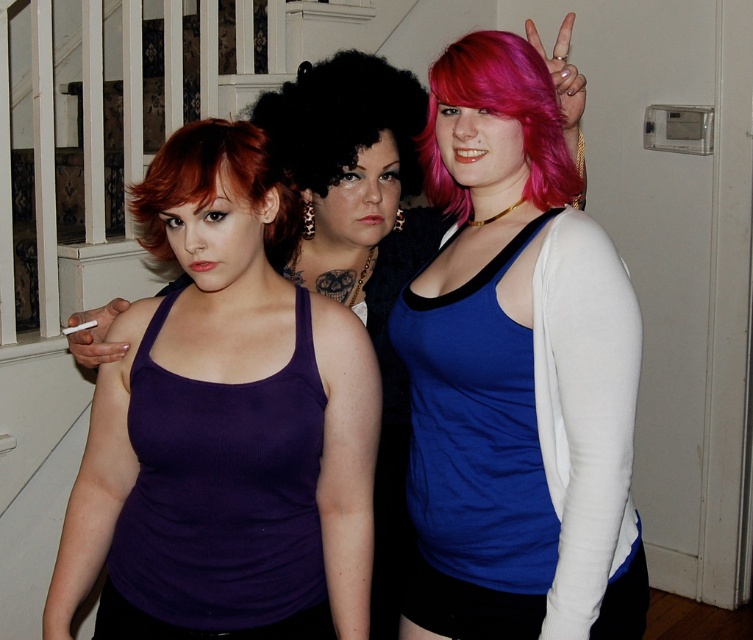
Can you confirm if purple ribbed tank top at left is wider than curly black hair at center?

Correct, the width of purple ribbed tank top at left exceeds that of curly black hair at center.

Is purple ribbed tank top at left taller than curly black hair at center?

Yes.

Is point (145, 214) farther from viewer compared to point (285, 116)?

No, it is in front of (285, 116).

At what (x,y) coordinates should I click in order to perform the action: click on purple ribbed tank top at left. Please return your answer as a coordinate pair (x, y). This screenshot has height=640, width=753. Looking at the image, I should click on (230, 362).

Does matte blue tank top at center appear on the right side of curly black hair at center?

Yes, matte blue tank top at center is to the right of curly black hair at center.

The height and width of the screenshot is (640, 753). What do you see at coordinates (517, 372) in the screenshot? I see `matte blue tank top at center` at bounding box center [517, 372].

Which is in front, point (617, 321) or point (305, 64)?

Point (617, 321) is in front.

Locate an element on the screen. The width and height of the screenshot is (753, 640). matte blue tank top at center is located at coordinates (517, 372).

Is purple ribbed tank top at left thinner than white matte cigarette at center?

No, purple ribbed tank top at left is not thinner than white matte cigarette at center.

Is point (364, 413) positioned before point (69, 328)?

Yes, it is.

Locate an element on the screen. Image resolution: width=753 pixels, height=640 pixels. purple ribbed tank top at left is located at coordinates (230, 362).

Locate an element on the screen. This screenshot has width=753, height=640. purple ribbed tank top at left is located at coordinates (230, 362).